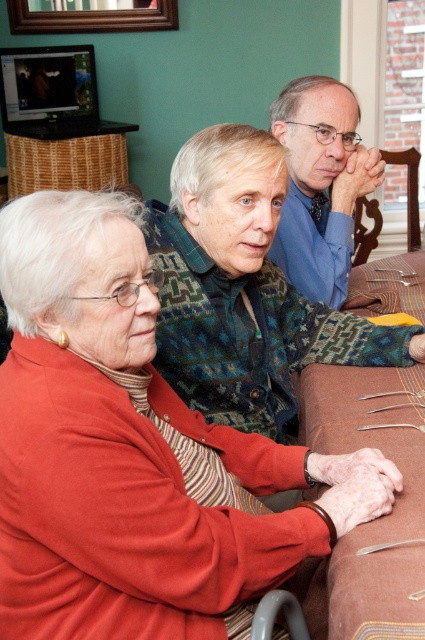
Who is taller, brown fabric table at center or blue smooth shirt at upper center?

Standing taller between the two is blue smooth shirt at upper center.

Does brown fabric table at center appear on the right side of blue smooth shirt at upper center?

Incorrect, brown fabric table at center is not on the right side of blue smooth shirt at upper center.

Does point (416, 416) come farther from viewer compared to point (291, 250)?

No, (416, 416) is in front of (291, 250).

I want to click on brown fabric table at center, so click(371, 520).

Between matte red sweater at center and blue smooth shirt at upper center, which one has less height?

Standing shorter between the two is blue smooth shirt at upper center.

Does matte red sweater at center come behind blue smooth shirt at upper center?

No, it is not.

Is point (56, 314) in front of point (289, 136)?

Yes, it is.

Where is `matte red sweater at center`? The width and height of the screenshot is (425, 640). matte red sweater at center is located at coordinates click(x=132, y=452).

Is matte red sweater at center smaller than brown fabric table at center?

No.

Looking at this image, does matte red sweater at center appear over brown fabric table at center?

Yes.

Between point (124, 474) and point (351, 566), which one is positioned in front?

Point (124, 474)

Find the location of `matte red sweater at center`. matte red sweater at center is located at coordinates (132, 452).